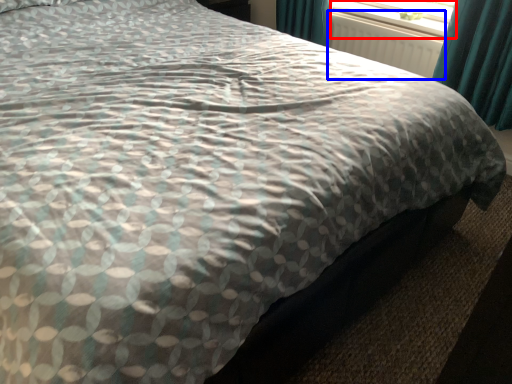
Question: Which object is closer to the camera taking this photo, window screen (highlighted by a red box) or radiator (highlighted by a blue box)?

Choices:
 (A) window screen
 (B) radiator

Answer: (B)